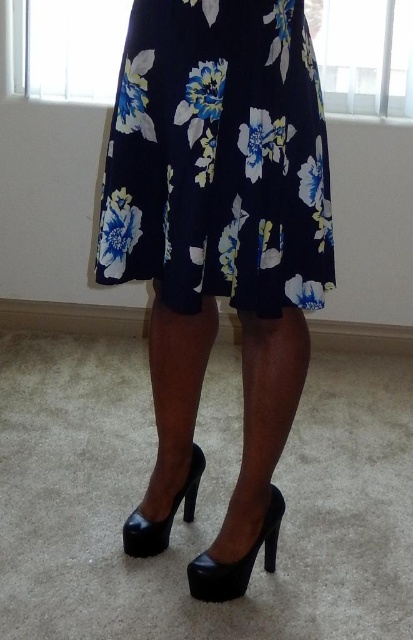
Question: Which point is closer to the camera?

Choices:
 (A) black leather high-heeled shoe at center
 (B) floral print skirt at center
 (C) black patent leather high-heeled shoe at lower center

Answer: (B)

Question: Does black patent leather high-heeled shoe at lower center have a smaller size compared to black leather high-heeled shoe at center?

Choices:
 (A) yes
 (B) no

Answer: (A)

Question: Which is farther from the black leather high-heeled shoe at center?

Choices:
 (A) floral print skirt at center
 (B) black patent leather high-heeled shoe at lower center

Answer: (A)

Question: From the image, what is the correct spatial relationship of floral print skirt at center in relation to black leather high-heeled shoe at center?

Choices:
 (A) right
 (B) left

Answer: (A)

Question: Which of the following is the farthest from the observer?

Choices:
 (A) black patent leather high-heeled shoe at lower center
 (B) black leather high-heeled shoe at center
 (C) floral print skirt at center

Answer: (B)

Question: Can you confirm if black patent leather high-heeled shoe at lower center is positioned to the left of black leather high-heeled shoe at center?

Choices:
 (A) no
 (B) yes

Answer: (A)